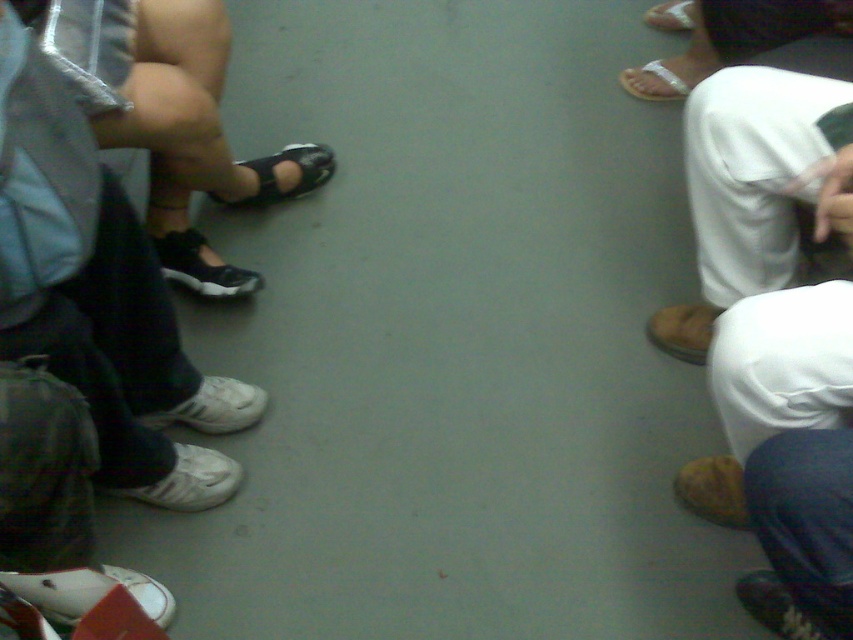
You are a passenger on a public transport vehicle and notice two sandals in the scene. The black leather sandal at center and the clear plastic sandal at upper right. Which sandal is positioned to the left of the other?

The black leather sandal at center is to the left of clear plastic sandal at upper right.